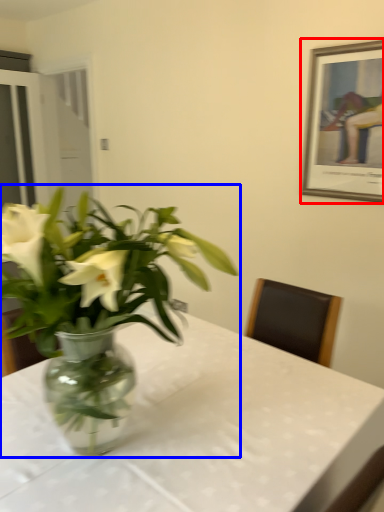
Question: Among these objects, which one is nearest to the camera, picture frame (highlighted by a red box) or houseplant (highlighted by a blue box)?

Choices:
 (A) picture frame
 (B) houseplant

Answer: (B)